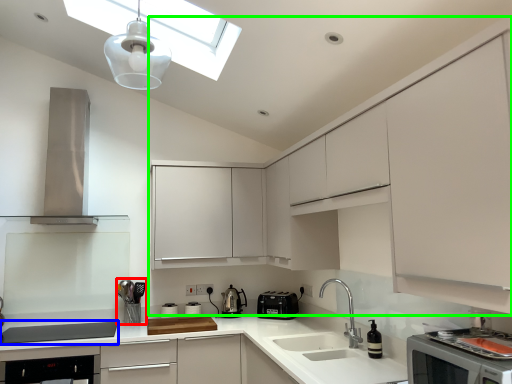
Question: Which object is the farthest from appliance (highlighted by a red box)? Choose among these: home appliance (highlighted by a blue box) or cabinetry (highlighted by a green box).

Choices:
 (A) home appliance
 (B) cabinetry

Answer: (B)